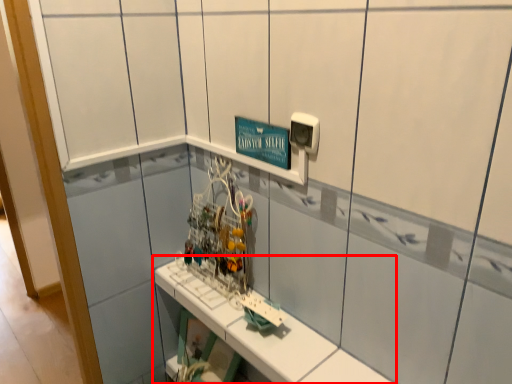
Question: From the image, what is the correct spatial relationship of shelf (annotated by the red box) in relation to electric outlet?

Choices:
 (A) right
 (B) left

Answer: (B)